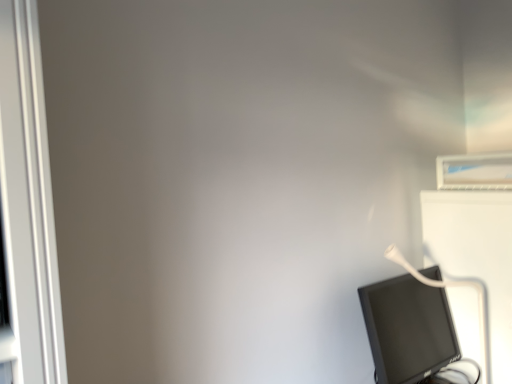
Question: Should I look upward or downward to see black glossy monitor at lower right?

Choices:
 (A) down
 (B) up

Answer: (A)